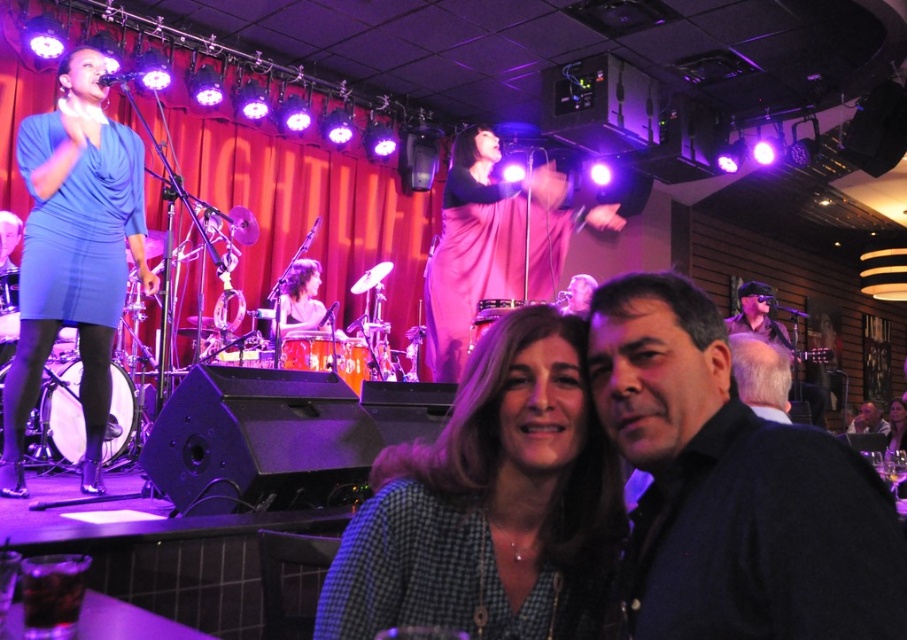
Is pink satin dress at center shorter than matte pink dress at center?

No.

Does point (534, 285) come closer to viewer compared to point (291, 308)?

Yes, point (534, 285) is closer to viewer.

Which is behind, point (557, 224) or point (317, 292)?

Positioned behind is point (317, 292).

What are the coordinates of `pink satin dress at center` in the screenshot? It's located at (494, 243).

Which is more to the right, checkered fabric shirt at center or gray hair at right?

From the viewer's perspective, gray hair at right appears more on the right side.

What do you see at coordinates (491, 504) in the screenshot?
I see `checkered fabric shirt at center` at bounding box center [491, 504].

This screenshot has height=640, width=907. I want to click on checkered fabric shirt at center, so click(491, 504).

This screenshot has width=907, height=640. Describe the element at coordinates (491, 504) in the screenshot. I see `checkered fabric shirt at center` at that location.

Can you confirm if checkered fabric shirt at center is smaller than matte pink dress at center?

Yes.

Between point (494, 577) and point (289, 289), which one is positioned in front?

Point (494, 577)

At what (x,y) coordinates should I click in order to perform the action: click on checkered fabric shirt at center. Please return your answer as a coordinate pair (x, y). Looking at the image, I should click on (491, 504).